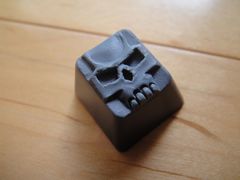
The height and width of the screenshot is (180, 240). I want to click on wooden table, so click(81, 125).